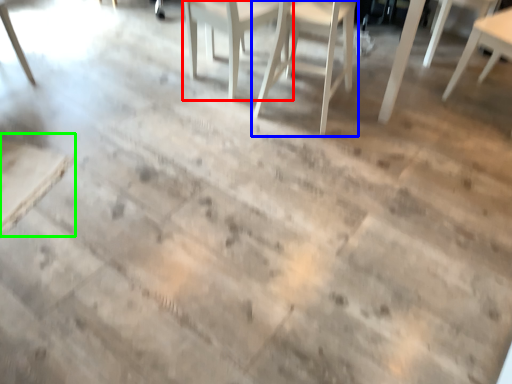
Question: Considering the real-world distances, which object is farthest from chair (highlighted by a red box)? chair (highlighted by a blue box) or table (highlighted by a green box)?

Choices:
 (A) chair
 (B) table

Answer: (B)